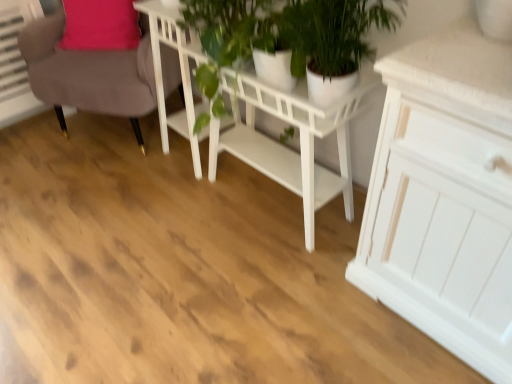
You are a GUI agent. You are given a task and a screenshot of the screen. Output one action in this format:
    pyautogui.click(x=<x>, y=<y>)
    Task: Click on the free space in front of suede-like brown chair at upper left
    
    Given the screenshot: What is the action you would take?
    [x=101, y=204]